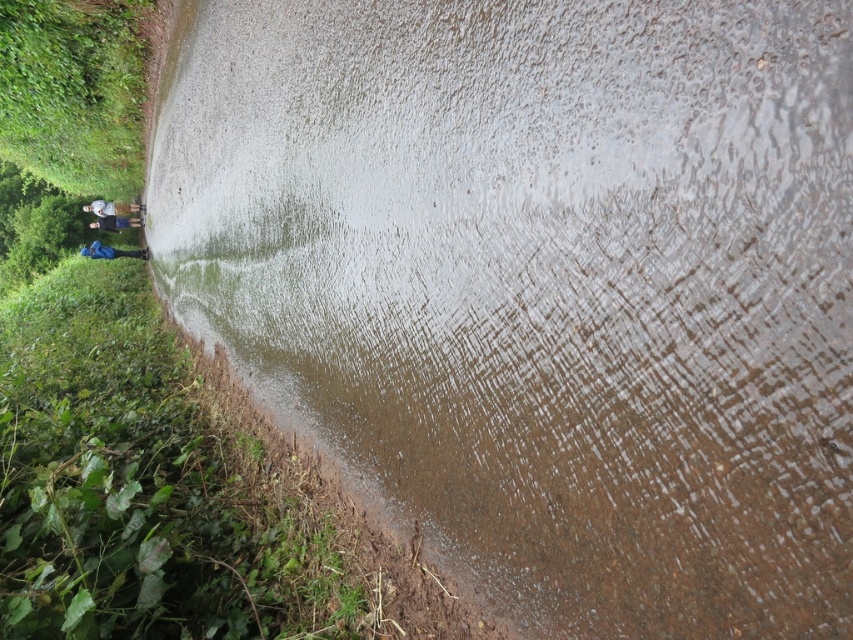
From the picture: Between blue fabric pants at left and blue fabric backpack at left, which one is positioned higher?

blue fabric pants at left is above.

Does blue fabric pants at left have a smaller size compared to blue fabric backpack at left?

Incorrect, blue fabric pants at left is not smaller in size than blue fabric backpack at left.

Does point (105, 220) come closer to viewer compared to point (103, 252)?

No, it is not.

Find the location of a particular element. blue fabric pants at left is located at coordinates (113, 214).